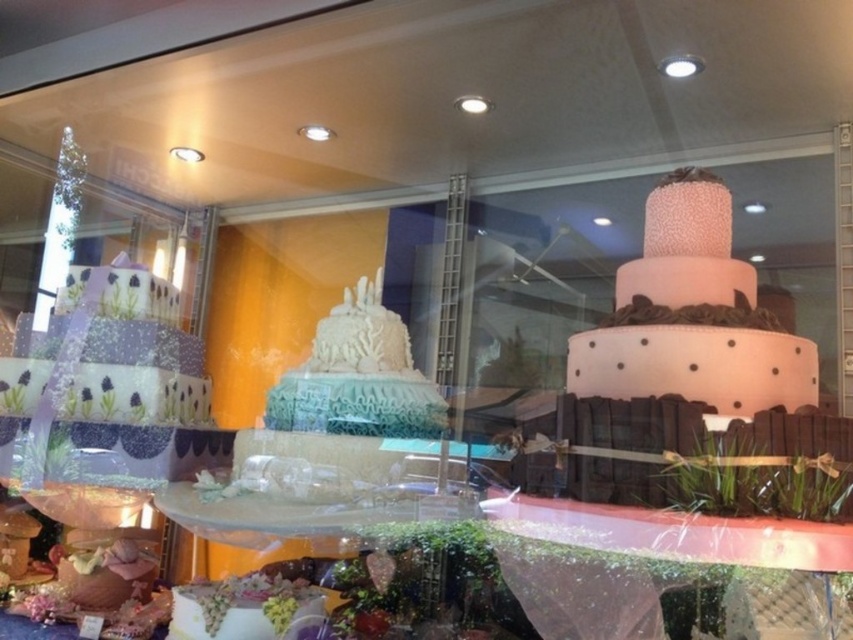
You are standing in front of the display window of a bakery and see two points marked in the scene. The first point is at coordinate point(103, 310) and the second point is at point(257, 614). Which point is closer to you?

Point(103, 310) is closer to you than point(257, 614) because it is further to the camera than the other point.